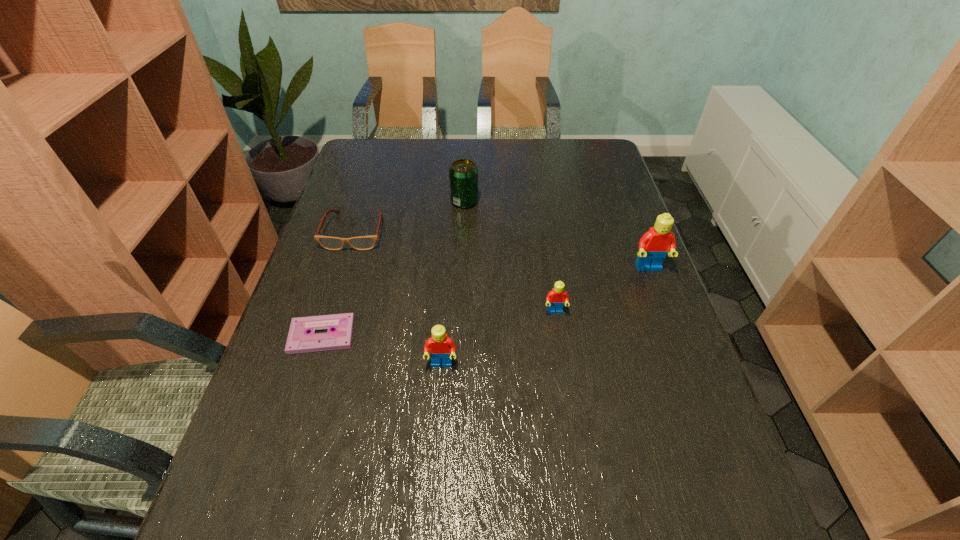
In order to click on vacant space that is in between the beer can and the nearest Lego in this screenshot , I will do `click(453, 283)`.

At what (x,y) coordinates should I click in order to perform the action: click on vacant area between the spectacles and the fourth tallest object. Please return your answer as a coordinate pair (x, y). The image size is (960, 540). Looking at the image, I should click on (455, 272).

You are a GUI agent. You are given a task and a screenshot of the screen. Output one action in this format:
    pyautogui.click(x=<x>, y=<y>)
    Task: Click on the free space between the second shortest object and the second Lego from right to left
    This screenshot has width=960, height=540.
    Given the screenshot: What is the action you would take?
    pyautogui.click(x=455, y=272)

This screenshot has height=540, width=960. In order to click on free point between the nearest Lego and the beer can in this screenshot , I will do `click(453, 283)`.

Choose which object is the fifth nearest neighbor to the second farthest Lego. Please provide its 2D coordinates. Your answer should be formatted as a tuple, i.e. [(x, y)], where the tuple contains the x and y coordinates of a point satisfying the conditions above.

[(368, 242)]

Locate which object ranks third in proximity to the second Lego from right to left. Please provide its 2D coordinates. Your answer should be formatted as a tuple, i.e. [(x, y)], where the tuple contains the x and y coordinates of a point satisfying the conditions above.

[(463, 173)]

Identify the location of Lego that is the closest one to the shortest object. Image resolution: width=960 pixels, height=540 pixels. (441, 346).

Find the location of a particular element. The width and height of the screenshot is (960, 540). Lego that stands as the third closest to the beer can is located at coordinates click(441, 346).

The height and width of the screenshot is (540, 960). I want to click on free point that satisfies the following two spatial constraints: 1. on the back side of the beer can; 2. on the left side of the shortest object, so click(363, 201).